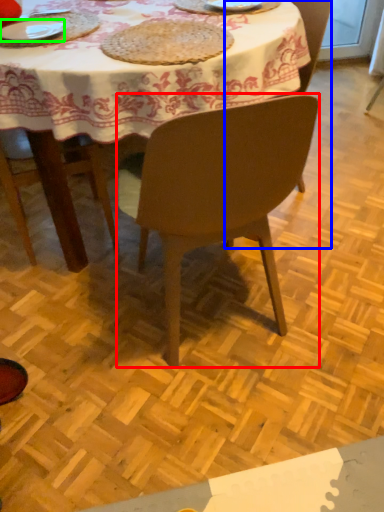
Question: Which object is the farthest from chair (highlighted by a red box)? Choose among these: chair (highlighted by a blue box) or plate (highlighted by a green box).

Choices:
 (A) chair
 (B) plate

Answer: (B)